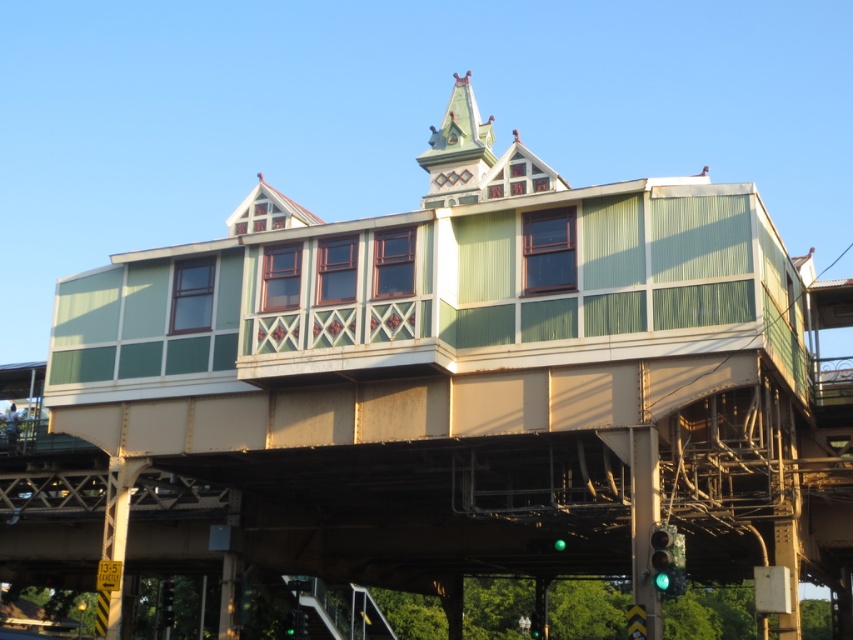
Question: Which of the following is the closest to the observer?

Choices:
 (A) green glass traffic light at lower center
 (B) green glass traffic light at upper center

Answer: (A)

Question: Which point is farther to the camera?

Choices:
 (A) green glass traffic light at lower right
 (B) green glass traffic light at lower center

Answer: (B)

Question: Which of the following is the farthest from the observer?

Choices:
 (A) (535, 636)
 (B) (663, 550)
 (C) (163, 625)

Answer: (C)

Question: Is green glass traffic light at upper center to the left of green glass traffic light at lower center from the viewer's perspective?

Choices:
 (A) yes
 (B) no

Answer: (A)

Question: Does green glass traffic light at lower right lie behind green glass traffic light at lower center?

Choices:
 (A) no
 (B) yes

Answer: (A)

Question: From the image, what is the correct spatial relationship of green glass traffic light at lower right in relation to green glass traffic light at upper center?

Choices:
 (A) above
 (B) below

Answer: (A)